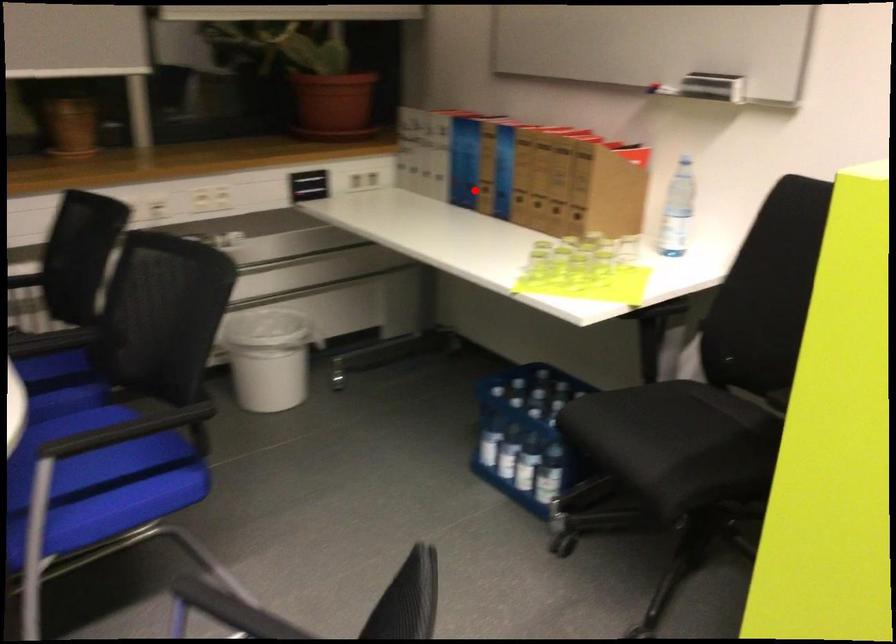
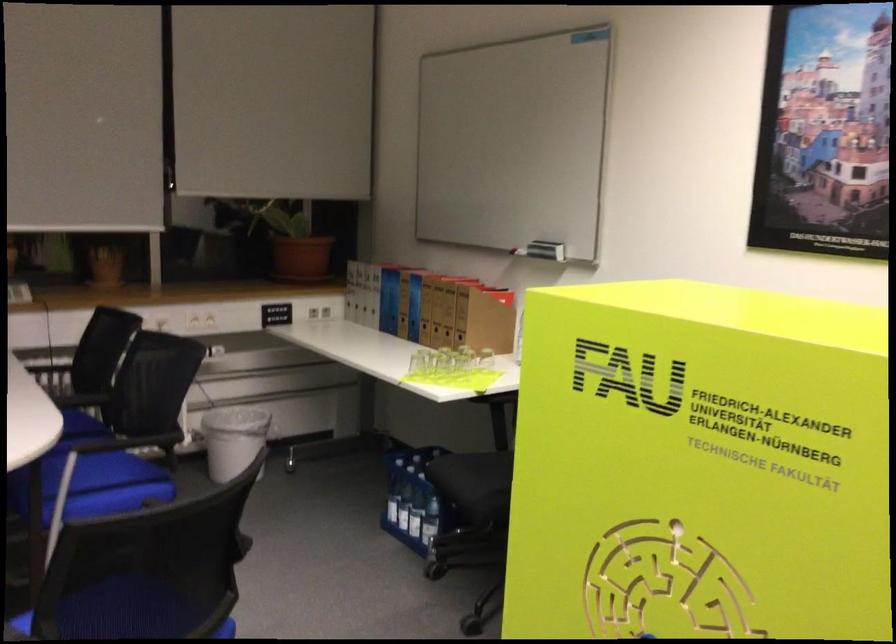
Question: I am providing you with two images of the same scene from different viewpoints. Image1 has a red point marked. In image2, the corresponding 3D location appears at what relative position? Reply with the corresponding letter.

Choices:
 (A) Closer
 (B) Farther

Answer: (B)